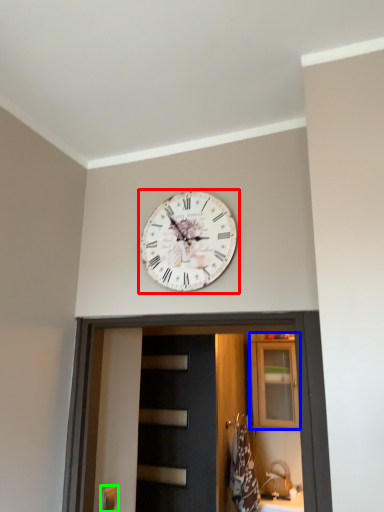
Question: Based on their relative distances, which object is farther from wall clock (highlighted by a red box)? Choose from cabinetry (highlighted by a blue box) and door handle (highlighted by a green box).

Choices:
 (A) cabinetry
 (B) door handle

Answer: (A)